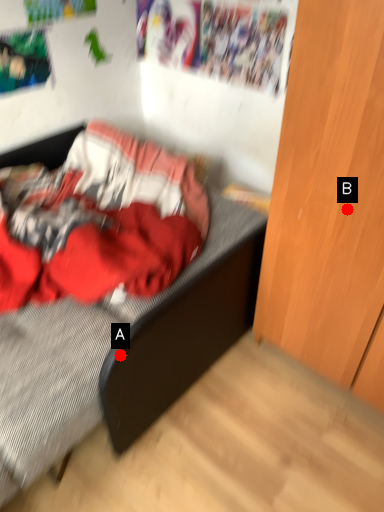
Question: Two points are circled on the image, labeled by A and B beside each circle. Which point is farther from the camera taking this photo?

Choices:
 (A) A is further
 (B) B is further

Answer: (B)